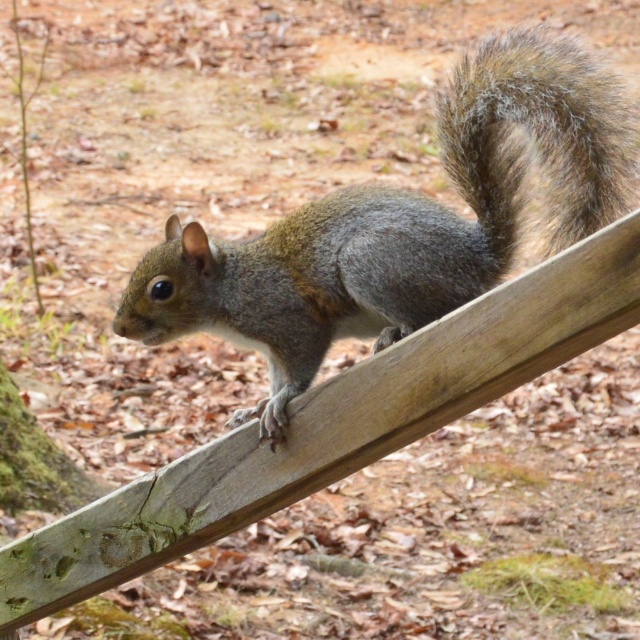
Question: Can you confirm if gray furry squirrel on the right is wider than fuzzy brown tail at upper right?

Choices:
 (A) no
 (B) yes

Answer: (B)

Question: Which point is farther to the camera?

Choices:
 (A) gray furry squirrel on the right
 (B) fuzzy brown tail at upper right

Answer: (B)

Question: Does gray furry squirrel on the right have a smaller size compared to fuzzy brown tail at upper right?

Choices:
 (A) yes
 (B) no

Answer: (B)

Question: Can you confirm if gray furry squirrel on the right is bigger than fuzzy brown tail at upper right?

Choices:
 (A) yes
 (B) no

Answer: (A)